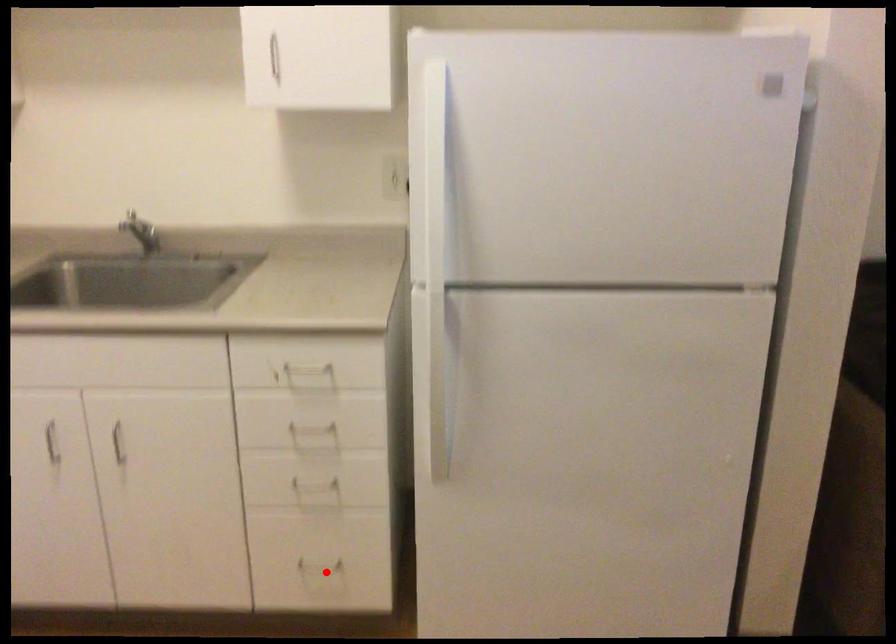
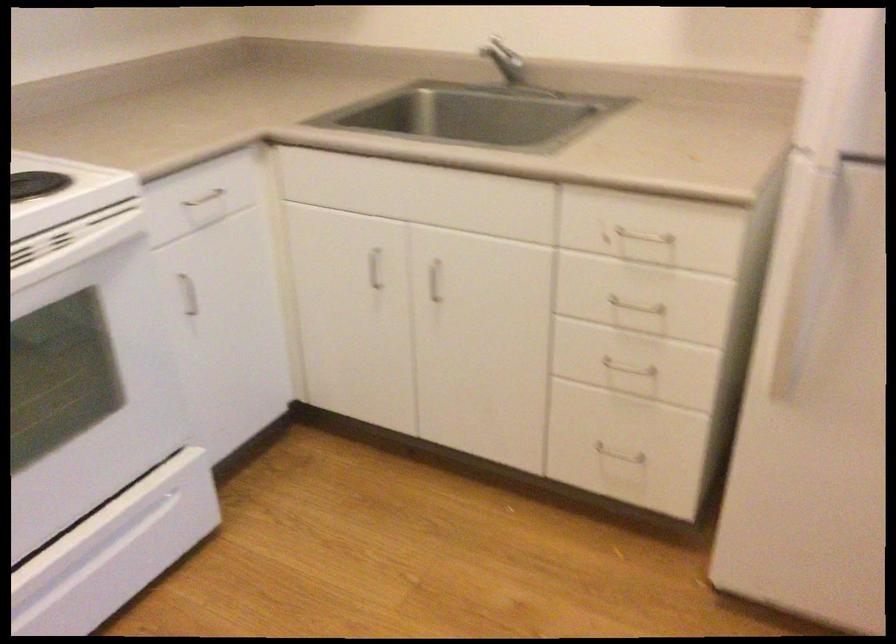
The point at the highlighted location is marked in the first image. Where is the corresponding point in the second image?

(619, 464)